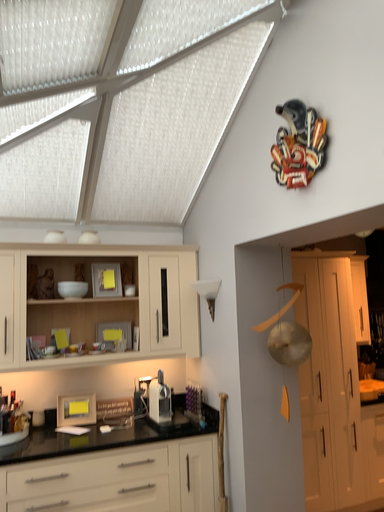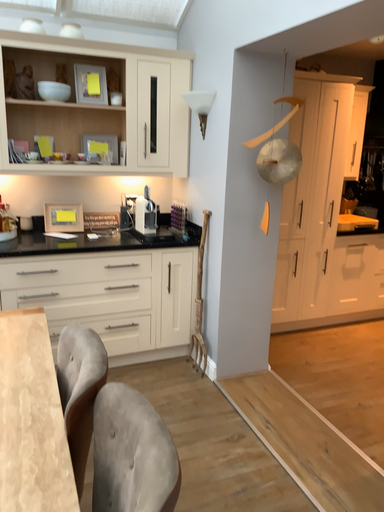
Question: Which way did the camera rotate in the video?

Choices:
 (A) rotated upward
 (B) rotated downward

Answer: (B)